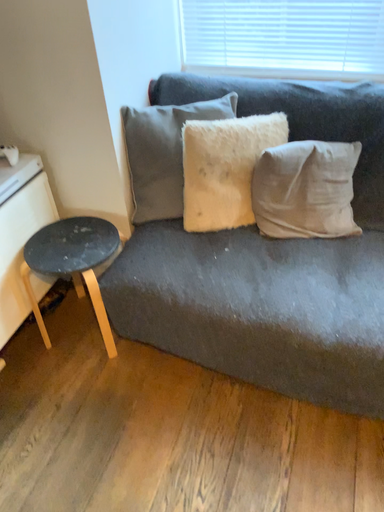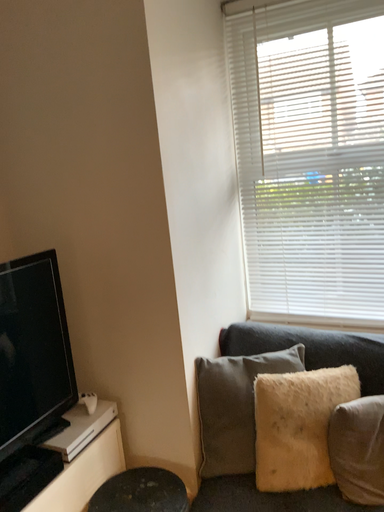
Question: How did the camera likely rotate when shooting the video?

Choices:
 (A) rotated downward
 (B) rotated upward

Answer: (B)